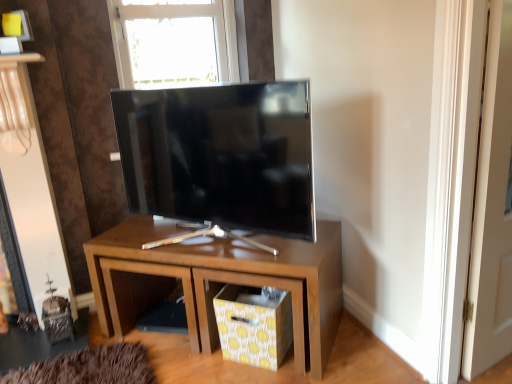
The height and width of the screenshot is (384, 512). In order to click on free area in between matte wood nightstand at center and yellow dotted fabric drawer at lower center in this screenshot , I will do `click(210, 361)`.